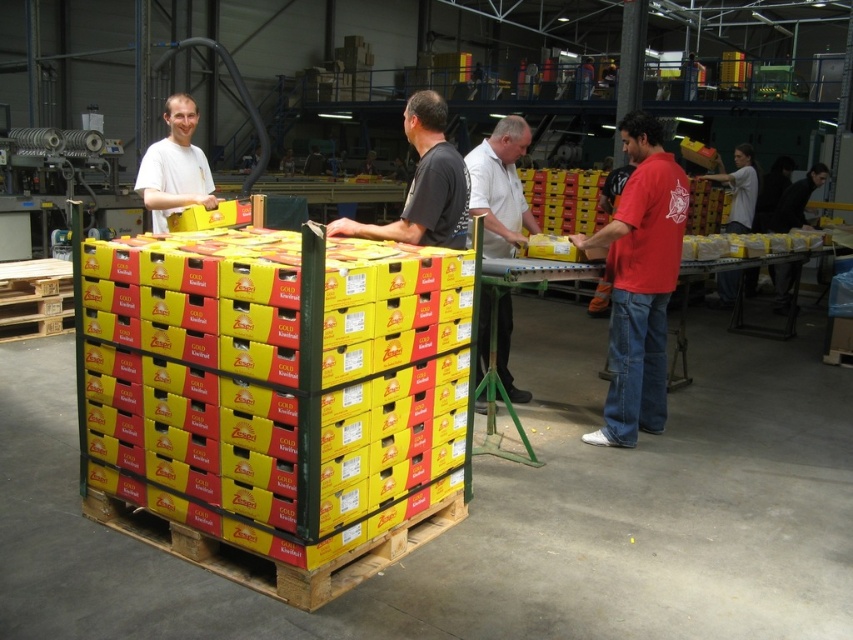
Question: Which object appears closest to the camera in this image?

Choices:
 (A) white matte shirt at center
 (B) red cotton shirt at right
 (C) dark gray shirt at center

Answer: (A)

Question: Does white matte shirt at center appear over dark gray shirt at center?

Choices:
 (A) yes
 (B) no

Answer: (B)

Question: Among these points, which one is nearest to the camera?

Choices:
 (A) (496, 161)
 (B) (415, 145)
 (C) (683, 186)

Answer: (B)

Question: Can you confirm if red cotton shirt at right is positioned to the left of matte white shirt at left?

Choices:
 (A) no
 (B) yes

Answer: (A)

Question: Is red cotton shirt at right in front of white matte shirt at center?

Choices:
 (A) no
 (B) yes

Answer: (A)

Question: Estimate the real-world distances between objects in this image. Which object is farther from the matte white shirt at left?

Choices:
 (A) red cotton shirt at right
 (B) dark gray shirt at center

Answer: (A)